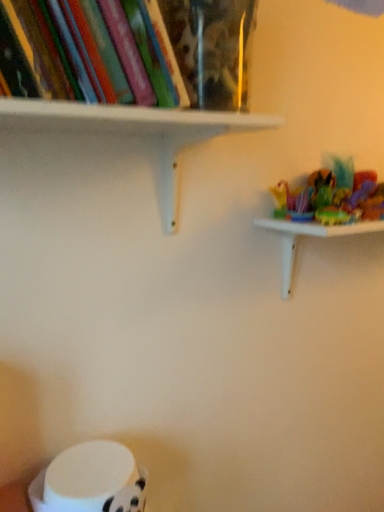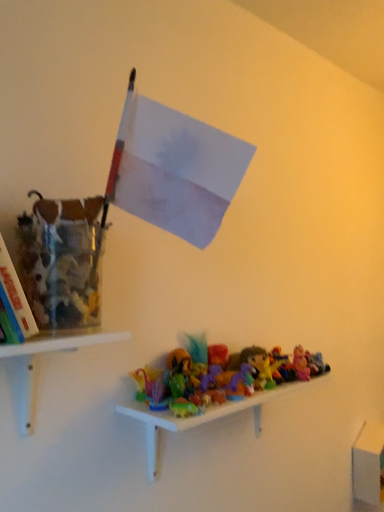
Question: How did the camera likely rotate when shooting the video?

Choices:
 (A) rotated right
 (B) rotated left

Answer: (A)